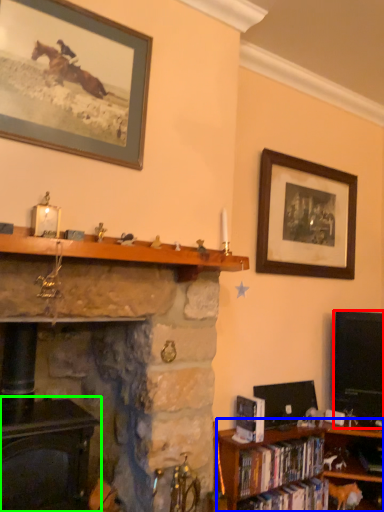
Question: Which is nearer to the television (highlighted by a red box)? bookcase (highlighted by a blue box) or fireplace (highlighted by a green box).

Choices:
 (A) bookcase
 (B) fireplace

Answer: (A)